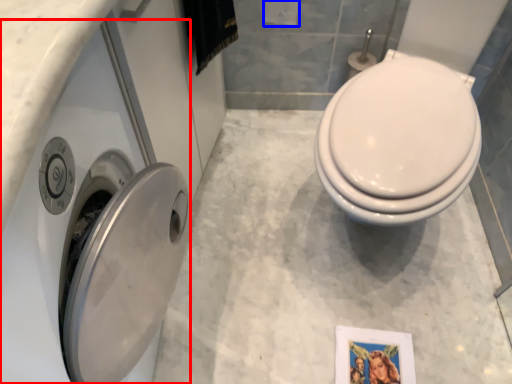
Question: Which object appears closest to the camera in this image, washer (highlighted by a red box) or toilet paper (highlighted by a blue box)?

Choices:
 (A) washer
 (B) toilet paper

Answer: (A)